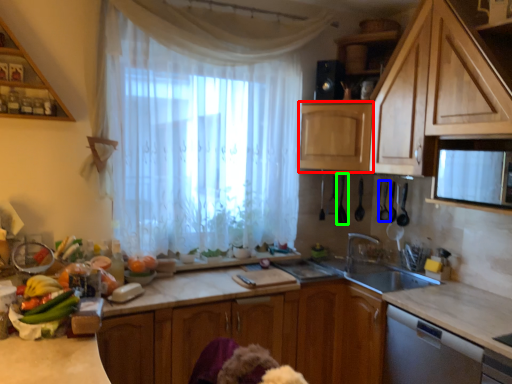
Question: Which object is positioned farthest from cabinetry (highlighted by a red box)? Select from appliance (highlighted by a blue box) and appliance (highlighted by a green box).

Choices:
 (A) appliance
 (B) appliance

Answer: (A)